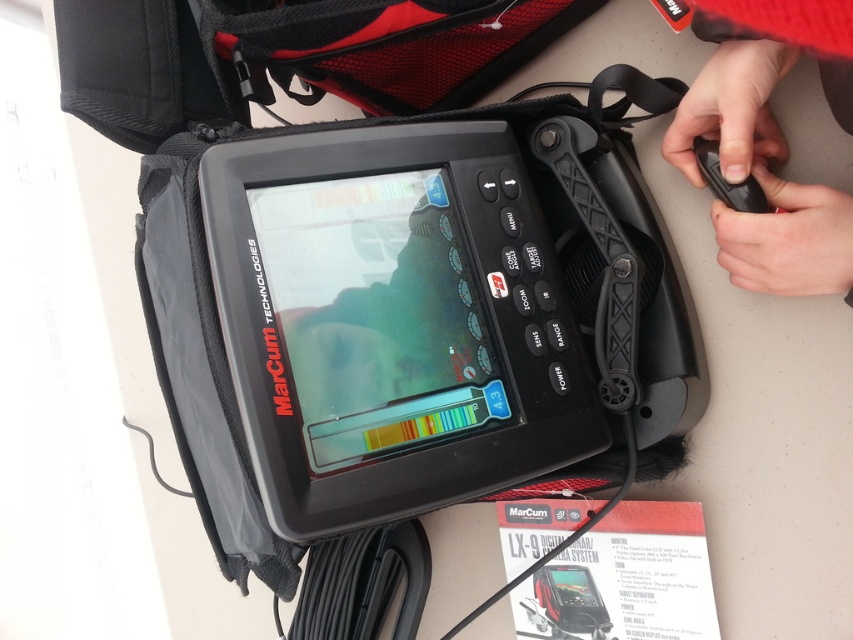
You are holding the black matte remote control at upper right and want to place it next to the black rubber remote control at upper right on a narrow shelf. Which remote control should you place first to ensure both fit on the shelf?

The black rubber remote control at upper right is narrower, so place it first to leave space for the wider black matte remote control at upper right.

You are holding the MarCum LX 9 Digital Sonar Camera System and want to press the button located at point (807, 285). However, there is another button at point (709, 184). Which button will your finger touch first when reaching towards the first button?

Point (807, 285) is in front of point (709, 184), so your finger will touch the button at point (807, 285) first.